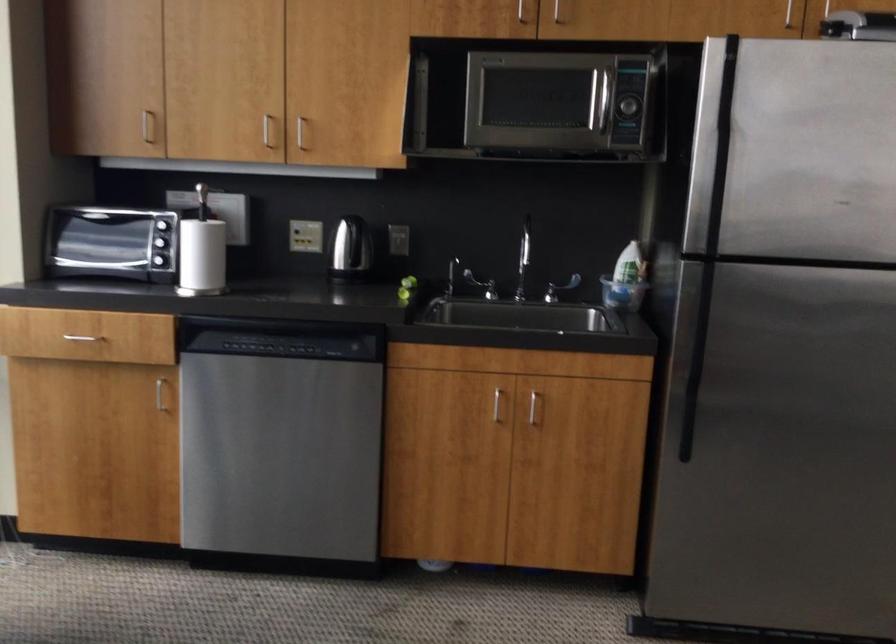
What do you see at coordinates (165, 243) in the screenshot? I see `the toaster oven handle` at bounding box center [165, 243].